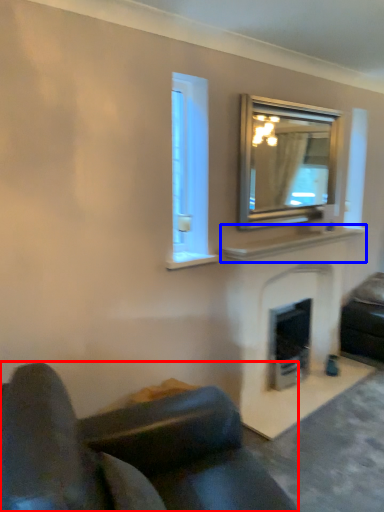
Question: Which object is further to the camera taking this photo, studio couch (highlighted by a red box) or mantle (highlighted by a blue box)?

Choices:
 (A) studio couch
 (B) mantle

Answer: (B)